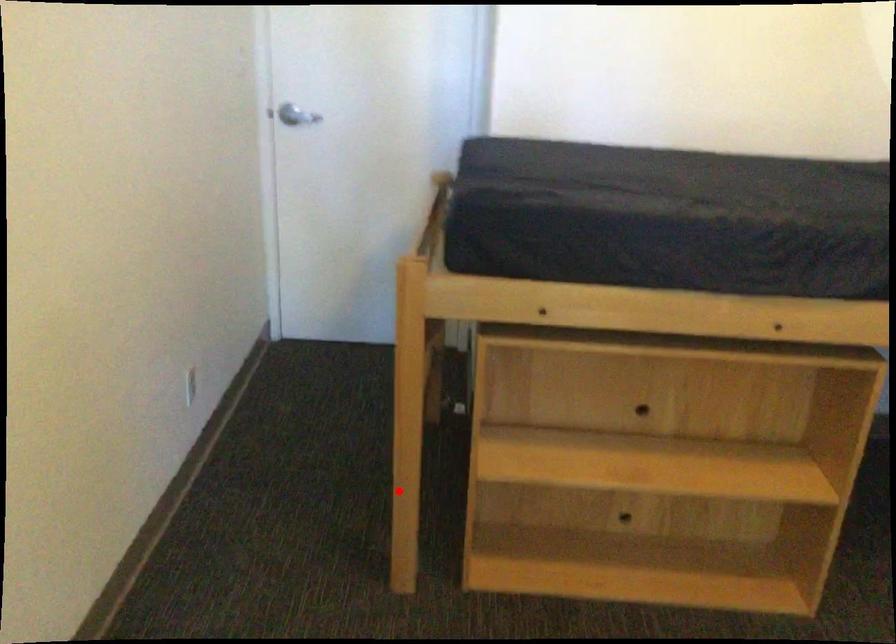
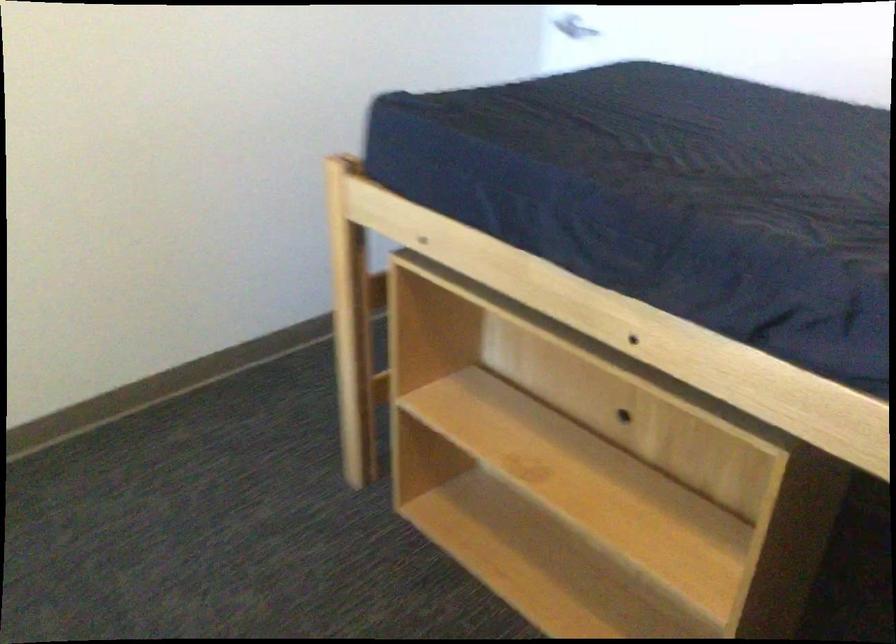
Find the pixel in the second image that matches the highlighted location in the first image.

(377, 397)